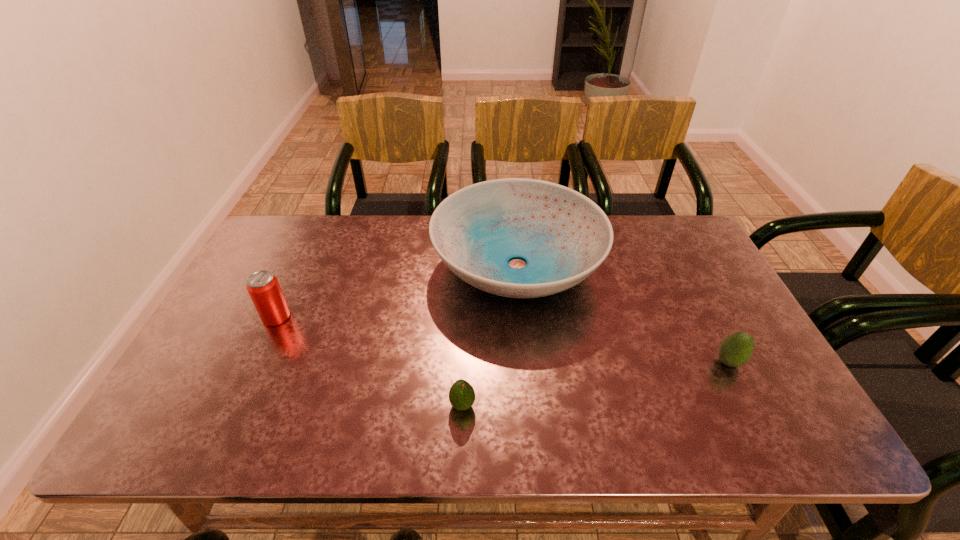
Identify the location of dish. (563, 236).

Locate an element on the screen. This screenshot has height=540, width=960. the leftmost object is located at coordinates (263, 287).

Find the location of `the taller avocado`. the taller avocado is located at coordinates (735, 350).

Find the location of `the farther avocado`. the farther avocado is located at coordinates (735, 350).

I want to click on the shortest object, so click(461, 395).

Find the location of `the nearer avocado`. the nearer avocado is located at coordinates (461, 395).

I want to click on vacant space located on the left of the dish, so click(342, 264).

Identify the location of vacant position located 0.260m on the front of the can. Image resolution: width=960 pixels, height=540 pixels. (230, 416).

You are a GUI agent. You are given a task and a screenshot of the screen. Output one action in this format:
    pyautogui.click(x=<x>, y=<y>)
    Task: Click on the vacant space located 0.120m on the front of the right avocado
    Image resolution: width=960 pixels, height=540 pixels.
    Given the screenshot: What is the action you would take?
    pyautogui.click(x=757, y=418)

What are the coordinates of `blank space located 0.310m on the back of the nearest object` in the screenshot? It's located at (466, 299).